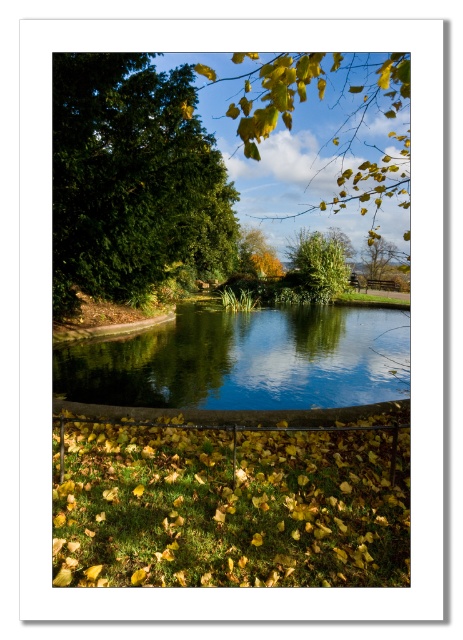
Question: Estimate the real-world distances between objects in this image. Which object is closer to the yellow matte leaves at lower center?

Choices:
 (A) green leafy tree at upper center
 (B) clear blue water at center

Answer: (B)

Question: Is yellow leaf litter at lower center to the left of green leafy tree at upper left from the viewer's perspective?

Choices:
 (A) no
 (B) yes

Answer: (A)

Question: Which object appears farthest from the camera in this image?

Choices:
 (A) clear blue water at center
 (B) yellow leaf litter at lower center
 (C) green leafy tree at upper left

Answer: (C)

Question: Can you confirm if yellow leaf litter at lower center is positioned above green leafy tree at upper center?

Choices:
 (A) yes
 (B) no

Answer: (B)

Question: Which point is closer to the camera?

Choices:
 (A) [x=310, y=342]
 (B) [x=256, y=355]
 (C) [x=70, y=483]

Answer: (C)

Question: Can you confirm if yellow matte leaves at lower center is wider than green leafy tree at upper left?

Choices:
 (A) no
 (B) yes

Answer: (B)